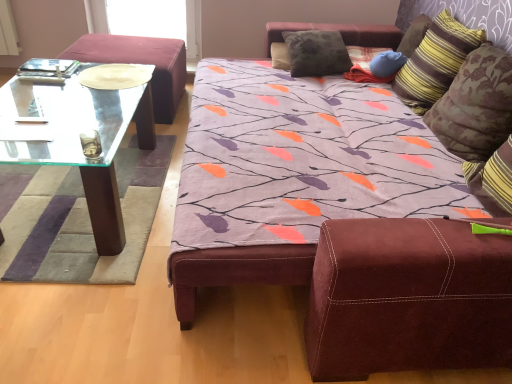
Question: Considering the relative sizes of blue fabric pillow at upper right, which appears as the 3th pillow when viewed from the right, and transparent glass coffee table at left in the image provided, is blue fabric pillow at upper right, which appears as the 3th pillow when viewed from the right, taller than transparent glass coffee table at left?

Choices:
 (A) no
 (B) yes

Answer: (B)

Question: From a real-world perspective, is blue fabric pillow at upper right, which appears as the 3th pillow when viewed from the right, beneath transparent glass coffee table at left?

Choices:
 (A) no
 (B) yes

Answer: (A)

Question: Is the position of blue fabric pillow at upper right, which is counted as the second pillow, starting from the left, less distant than that of transparent glass coffee table at left?

Choices:
 (A) yes
 (B) no

Answer: (B)

Question: Is blue fabric pillow at upper right, which is counted as the second pillow, starting from the left, shorter than transparent glass coffee table at left?

Choices:
 (A) no
 (B) yes

Answer: (A)

Question: Is blue fabric pillow at upper right, which appears as the 3th pillow when viewed from the right, facing towards transparent glass coffee table at left?

Choices:
 (A) yes
 (B) no

Answer: (A)

Question: From the image's perspective, is blue fabric pillow at upper right, which is counted as the second pillow, starting from the left, beneath transparent glass coffee table at left?

Choices:
 (A) yes
 (B) no

Answer: (B)

Question: Is striped fabric pillow at upper right, which is the 3th pillow from left to right, facing away from striped fabric pillow at upper right, placed as the fourth pillow when sorted from left to right?

Choices:
 (A) no
 (B) yes

Answer: (A)

Question: From the image's perspective, is striped fabric pillow at upper right, which is the 3th pillow from left to right, below striped fabric pillow at upper right, the 1th pillow positioned from the right?

Choices:
 (A) no
 (B) yes

Answer: (A)

Question: Considering the relative sizes of striped fabric pillow at upper right, marked as the second pillow in a right-to-left arrangement, and striped fabric pillow at upper right, placed as the fourth pillow when sorted from left to right, in the image provided, is striped fabric pillow at upper right, marked as the second pillow in a right-to-left arrangement, thinner than striped fabric pillow at upper right, placed as the fourth pillow when sorted from left to right,?

Choices:
 (A) no
 (B) yes

Answer: (A)

Question: Is striped fabric pillow at upper right, marked as the second pillow in a right-to-left arrangement, bigger than striped fabric pillow at upper right, the 1th pillow positioned from the right?

Choices:
 (A) yes
 (B) no

Answer: (A)

Question: Is striped fabric pillow at upper right, which is the 3th pillow from left to right, to the right of striped fabric pillow at upper right, the 1th pillow positioned from the right, from the viewer's perspective?

Choices:
 (A) no
 (B) yes

Answer: (A)

Question: Considering the relative sizes of striped fabric pillow at upper right, which is the 3th pillow from left to right, and striped fabric pillow at upper right, placed as the fourth pillow when sorted from left to right, in the image provided, is striped fabric pillow at upper right, which is the 3th pillow from left to right, wider than striped fabric pillow at upper right, placed as the fourth pillow when sorted from left to right,?

Choices:
 (A) yes
 (B) no

Answer: (A)

Question: Could you tell me if blue fabric pillow at upper right, which appears as the 3th pillow when viewed from the right, is facing striped fabric pillow at upper right, marked as the second pillow in a right-to-left arrangement?

Choices:
 (A) yes
 (B) no

Answer: (A)